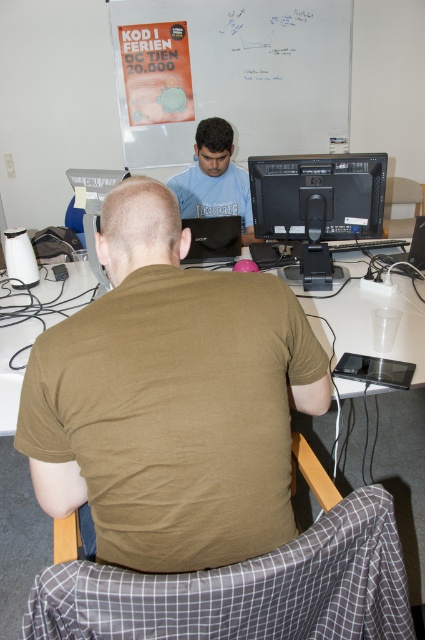
You are trying to determine if the black glossy monitor at center can fit into a storage box that is exactly the same size as the matte blue shirt at center. Based on the scene, will it fit?

The black glossy monitor at center has a width larger than the matte blue shirt at center, so it will not fit into the storage box designed for the shirt.

You are standing at the point labeled point (297, 196) and want to walk to the point labeled point (85, 284). Will you need to walk towards the camera or away from it?

You will need to walk away from the camera because point (297, 196) is in front of point (85, 284), meaning the destination is behind your current position.